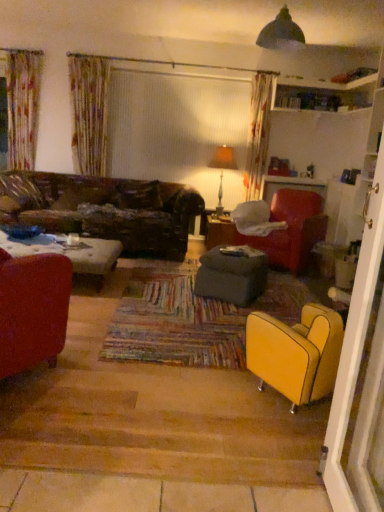
Find the location of `vacant space that is to the left of yellow leather armchair at lower right, the 2th chair from the right`. vacant space that is to the left of yellow leather armchair at lower right, the 2th chair from the right is located at coordinates (220, 394).